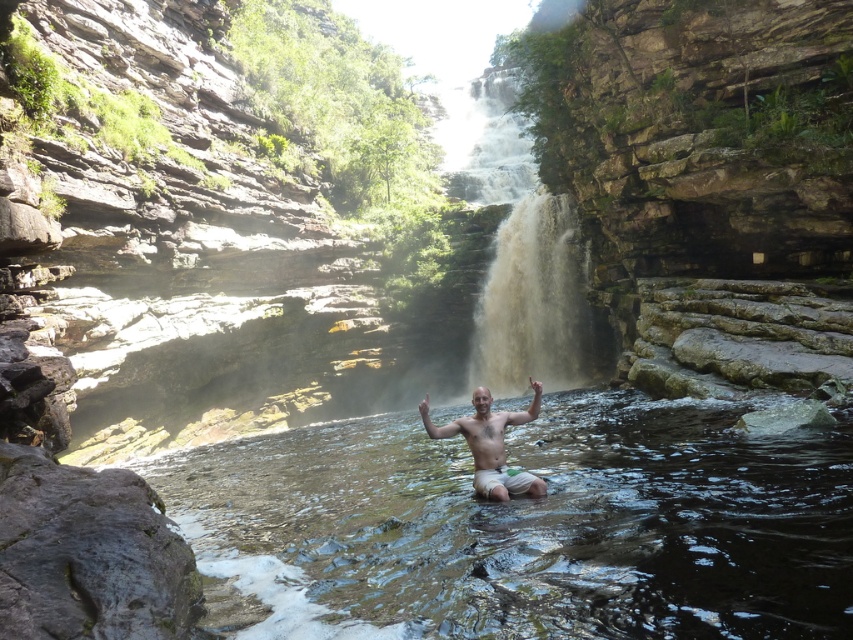
Does clear water at center have a lesser height compared to bare skin man at center?

No, clear water at center is not shorter than bare skin man at center.

Is clear water at center thinner than bare skin man at center?

No, clear water at center is not thinner than bare skin man at center.

Who is more distant from viewer, (512, 630) or (473, 392)?

The point (473, 392) is behind.

Locate an element on the screen. Image resolution: width=853 pixels, height=640 pixels. clear water at center is located at coordinates (525, 525).

Is the position of brown textured waterfall at center more distant than that of bare skin man at center?

Yes, it is behind bare skin man at center.

Which of these two, brown textured waterfall at center or bare skin man at center, stands taller?

brown textured waterfall at center is taller.

Image resolution: width=853 pixels, height=640 pixels. Identify the location of brown textured waterfall at center. (531, 300).

Between clear water at center and brown textured waterfall at center, which one appears on the right side from the viewer's perspective?

brown textured waterfall at center is more to the right.

Which is in front, point (474, 566) or point (505, 348)?

Point (474, 566)

Is point (705, 444) closer to camera compared to point (518, 358)?

Yes, it is in front of point (518, 358).

Image resolution: width=853 pixels, height=640 pixels. What are the coordinates of `clear water at center` in the screenshot? It's located at (525, 525).